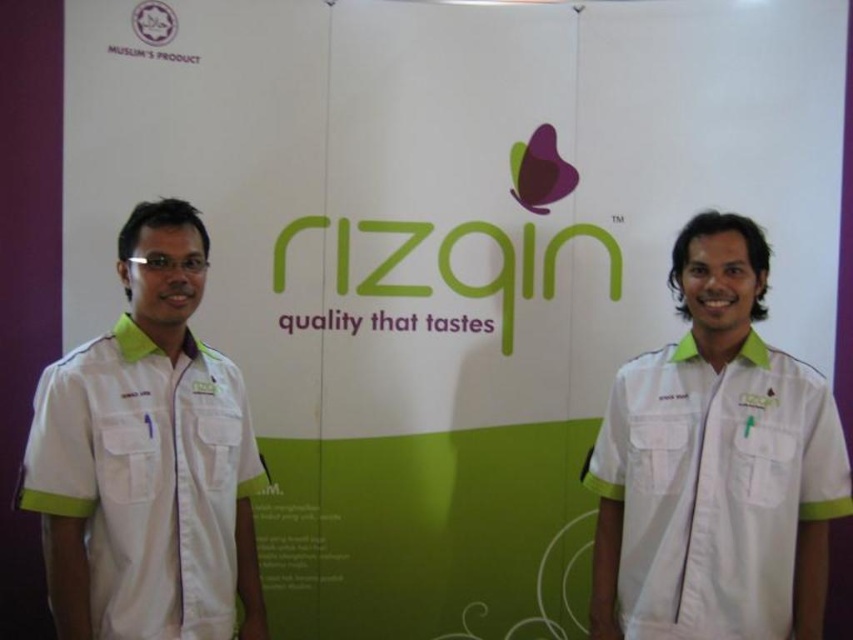
Question: Does white fabric shirt at left have a smaller size compared to matte plastic logo at upper left?

Choices:
 (A) no
 (B) yes

Answer: (A)

Question: Can you confirm if white fabric shirt at left is smaller than matte plastic logo at upper left?

Choices:
 (A) yes
 (B) no

Answer: (B)

Question: Which object is the closest to the white fabric shirt at left?

Choices:
 (A) matte plastic logo at upper left
 (B) white fabric shirt at center

Answer: (B)

Question: Is white fabric shirt at left thinner than matte plastic logo at upper left?

Choices:
 (A) no
 (B) yes

Answer: (A)

Question: Which of the following is the farthest from the observer?

Choices:
 (A) (169, 492)
 (B) (630, 570)

Answer: (B)

Question: Among these objects, which one is nearest to the camera?

Choices:
 (A) matte plastic logo at upper left
 (B) white fabric shirt at left

Answer: (B)